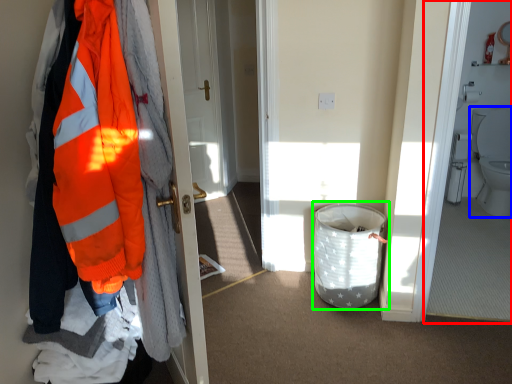
Question: Which object is the closest to the corridor (highlighted by a red box)? Choose among these: toilet (highlighted by a blue box) or laundry basket (highlighted by a green box).

Choices:
 (A) toilet
 (B) laundry basket

Answer: (A)